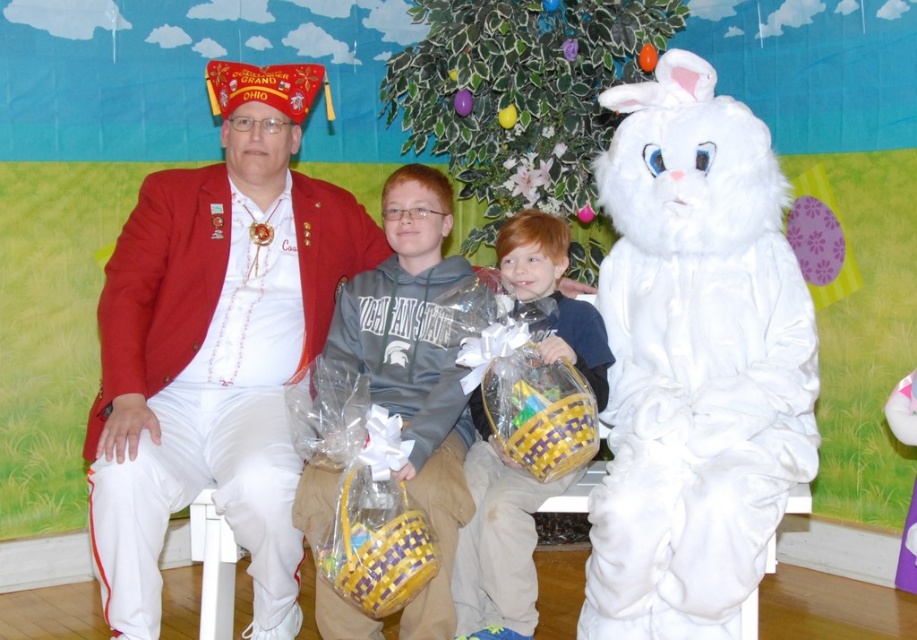
Between point (626, 545) and point (529, 547), which one is positioned behind?

Positioned behind is point (529, 547).

Who is shorter, white fluffy bunny at right or matte yellow basket at center?

Standing shorter between the two is matte yellow basket at center.

Which is behind, point (650, 278) or point (595, 321)?

Point (595, 321)

Find the location of a particular element. The height and width of the screenshot is (640, 917). white fluffy bunny at right is located at coordinates (694, 362).

This screenshot has width=917, height=640. What do you see at coordinates (498, 540) in the screenshot?
I see `matte yellow basket at center` at bounding box center [498, 540].

Who is shorter, matte yellow basket at center or woven yellow and purple basket at center?

woven yellow and purple basket at center

The image size is (917, 640). In order to click on matte yellow basket at center in this screenshot , I will do `click(498, 540)`.

The height and width of the screenshot is (640, 917). I want to click on matte yellow basket at center, so click(x=498, y=540).

Which is behind, point (207, 412) or point (418, 184)?

The point (418, 184) is behind.

Is matte red blazer at left taller than gray hoodie at center?

Yes, matte red blazer at left is taller than gray hoodie at center.

Is point (284, 150) positioned behind point (399, 296)?

That is False.

I want to click on matte red blazer at left, so click(x=216, y=348).